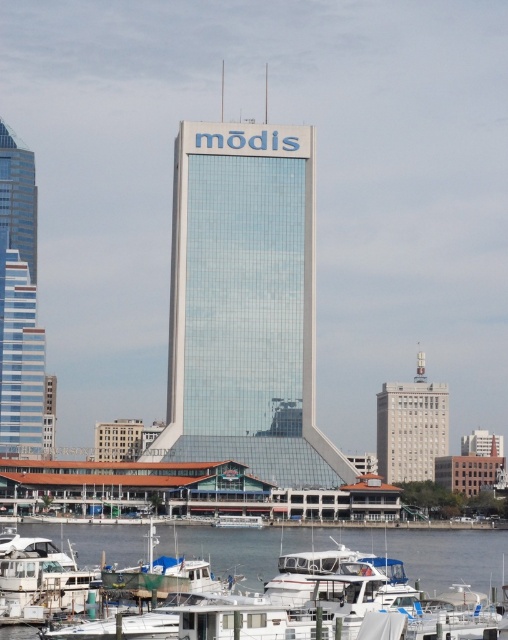
How much distance is there between white glossy boat at lower center and green tarpaulin boat at lower center?

white glossy boat at lower center is 19.28 meters from green tarpaulin boat at lower center.

Does white glossy boat at lower center have a larger size compared to green tarpaulin boat at lower center?

Yes, white glossy boat at lower center is bigger than green tarpaulin boat at lower center.

Describe the element at coordinates (432, 554) in the screenshot. I see `white glossy boat at lower center` at that location.

Locate an element on the screen. The height and width of the screenshot is (640, 508). white glossy boat at lower center is located at coordinates (432, 554).

Does white glossy boat at lower center have a greater height compared to glassy steel skyscraper at left?

No.

What do you see at coordinates (432, 554) in the screenshot? The width and height of the screenshot is (508, 640). I see `white glossy boat at lower center` at bounding box center [432, 554].

Where is `white glossy boat at lower center`? This screenshot has height=640, width=508. white glossy boat at lower center is located at coordinates (432, 554).

What do you see at coordinates (18, 305) in the screenshot?
I see `glassy steel skyscraper at left` at bounding box center [18, 305].

Can you confirm if glassy steel skyscraper at left is shorter than green tarpaulin boat at lower center?

No.

Find the location of a particular element. This screenshot has width=508, height=640. glassy steel skyscraper at left is located at coordinates (18, 305).